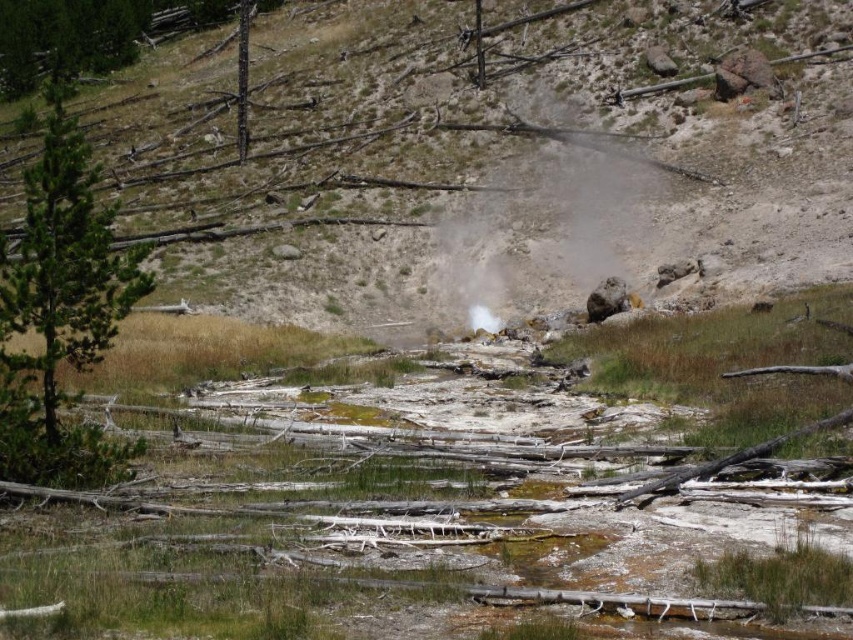
Question: Which of the following is the farthest from the observer?

Choices:
 (A) (28, 323)
 (B) (524, 268)

Answer: (B)

Question: Does green matte tree at left come in front of white vapor at center?

Choices:
 (A) no
 (B) yes

Answer: (B)

Question: Is dull brown dirt at center in front of green matte tree at left?

Choices:
 (A) no
 (B) yes

Answer: (A)

Question: Which is farther from the white vapor at center?

Choices:
 (A) green matte tree at left
 (B) dull brown dirt at center

Answer: (A)

Question: Which of the following is the farthest from the observer?

Choices:
 (A) green matte tree at left
 (B) white vapor at center
 (C) dull brown dirt at center

Answer: (B)

Question: Is dull brown dirt at center thinner than green matte tree at left?

Choices:
 (A) yes
 (B) no

Answer: (B)